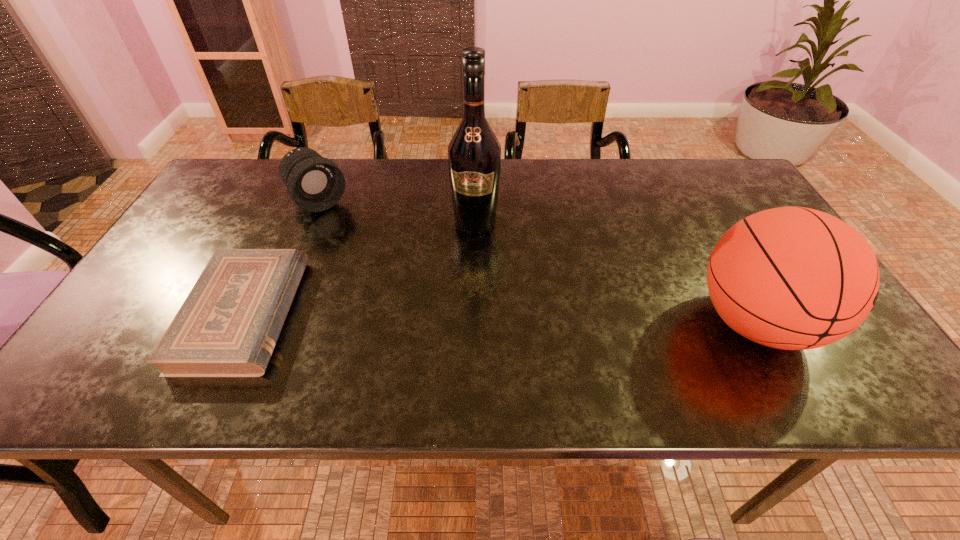
Locate an element on the screen. free space at the near edge of the desktop is located at coordinates (384, 342).

Locate an element on the screen. The image size is (960, 540). vacant space at the left edge of the desktop is located at coordinates (204, 266).

Identify the location of free space at the right edge of the desktop. (760, 205).

Find the location of a particular element. The width and height of the screenshot is (960, 540). vacant space at the far right corner is located at coordinates (725, 186).

Identify the location of unoccupied area between the wine bottle and the telephoto lens. Image resolution: width=960 pixels, height=540 pixels. 397,212.

Identify the location of free space between the wine bottle and the telephoto lens. This screenshot has height=540, width=960. (397, 212).

Image resolution: width=960 pixels, height=540 pixels. I want to click on empty space that is in between the rightmost object and the wine bottle, so tap(615, 273).

Where is `blank region between the tallest object and the shortest object`? This screenshot has width=960, height=540. blank region between the tallest object and the shortest object is located at coordinates (360, 269).

Find the location of a particular element. The height and width of the screenshot is (540, 960). free space between the third object from left to right and the third shortest object is located at coordinates (615, 273).

Locate an element on the screen. This screenshot has height=540, width=960. free spot between the second tallest object and the second shortest object is located at coordinates (537, 262).